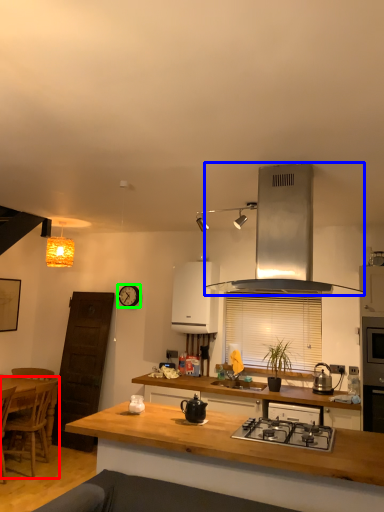
Question: Which object is positioned farthest from chair (highlighted by a red box)? Select from kitchen appliance (highlighted by a blue box) and clock (highlighted by a green box).

Choices:
 (A) kitchen appliance
 (B) clock

Answer: (A)